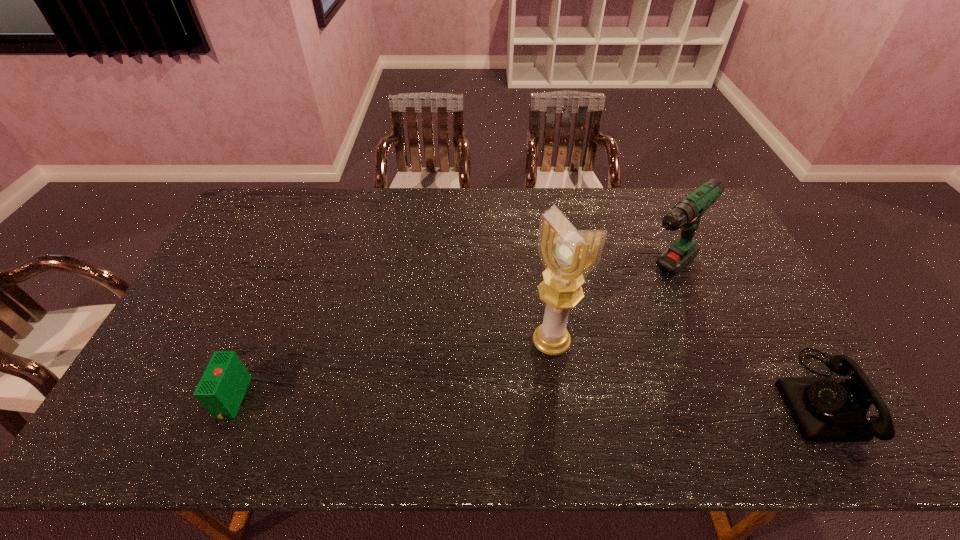
At what (x,y) coordinates should I click in order to perform the action: click on the leftmost object. Please return your answer as a coordinate pair (x, y). Looking at the image, I should click on (221, 389).

Image resolution: width=960 pixels, height=540 pixels. In order to click on the rightmost object in this screenshot , I will do `click(825, 409)`.

This screenshot has width=960, height=540. I want to click on the third shortest object, so click(x=686, y=214).

Find the location of a particular element. the third object from left to right is located at coordinates (686, 214).

At what (x,y) coordinates should I click in order to perform the action: click on the third object from right to left. Please return your answer as a coordinate pair (x, y). This screenshot has width=960, height=540. Looking at the image, I should click on (569, 255).

Find the location of a particular element. award is located at coordinates pyautogui.click(x=569, y=255).

The image size is (960, 540). I want to click on vacant space situated on the front-facing side of the leftmost object, so click(x=170, y=399).

This screenshot has height=540, width=960. What are the coordinates of `free space located on the front-facing side of the leftmost object` in the screenshot? It's located at (166, 399).

In order to click on vacant space positioned 0.160m on the front-facing side of the leftmost object in this screenshot , I will do click(157, 399).

Image resolution: width=960 pixels, height=540 pixels. Find the location of `free space located on the front face of the telephone`. free space located on the front face of the telephone is located at coordinates (636, 397).